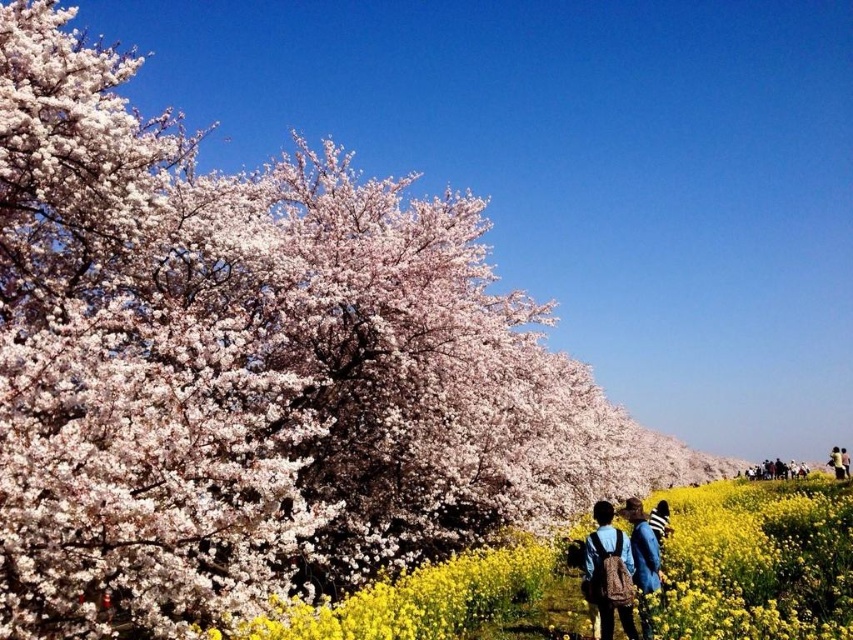
You are an artist planning to paint this scene. You want to ensure that the denim jacket at center and the blue denim jacket at lower right are proportionally accurate. Which jacket should you make larger in your painting?

The blue denim jacket at lower right should be painted larger because it occupies more space than the denim jacket at center.

You are standing in the middle of the cherry blossom field and see a denim jacket at center and a blue denim jacket at lower right. Which jacket is closer to the blossoming cherry trees?

The denim jacket at center is closer to the blossoming cherry trees because it is positioned above the blue denim jacket at lower right, which is further down towards the yellow flowers.

You are a photographer standing in the field of yellow flowers. You want to take a photo that includes both the white fluffy blossoms at center and the blue fabric jacket at lower right. Which object should you position closer to the left side of your camera frame?

You should position the blue fabric jacket at lower right closer to the left side of your camera frame because the white fluffy blossoms at center is to the right of it according to the description.